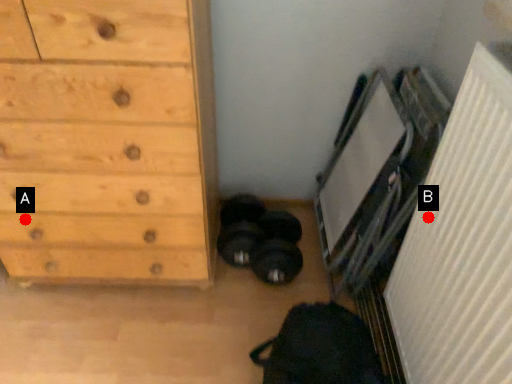
Question: Two points are circled on the image, labeled by A and B beside each circle. Among these points, which one is nearest to the camera?

Choices:
 (A) A is closer
 (B) B is closer

Answer: (B)